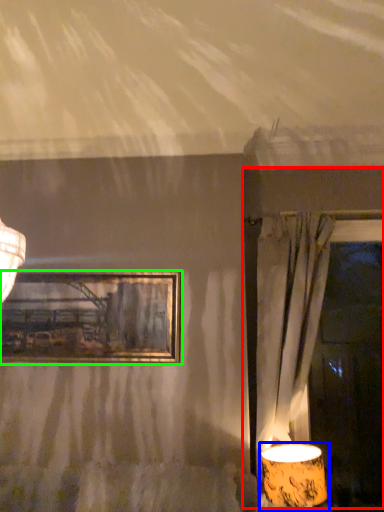
Question: Which object is the farthest from window frame (highlighted by a red box)? Choose among these: lamp (highlighted by a blue box) or picture frame (highlighted by a green box).

Choices:
 (A) lamp
 (B) picture frame

Answer: (B)